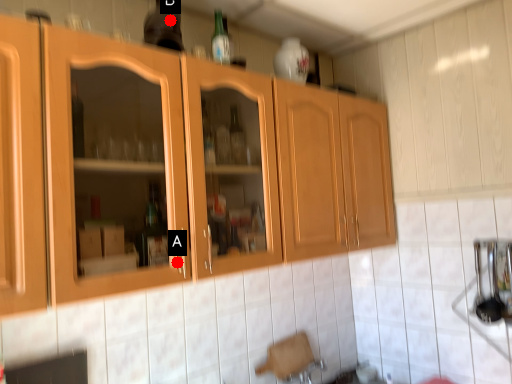
Question: Two points are circled on the image, labeled by A and B beside each circle. Which point is closer to the camera taking this photo?

Choices:
 (A) A is closer
 (B) B is closer

Answer: (A)